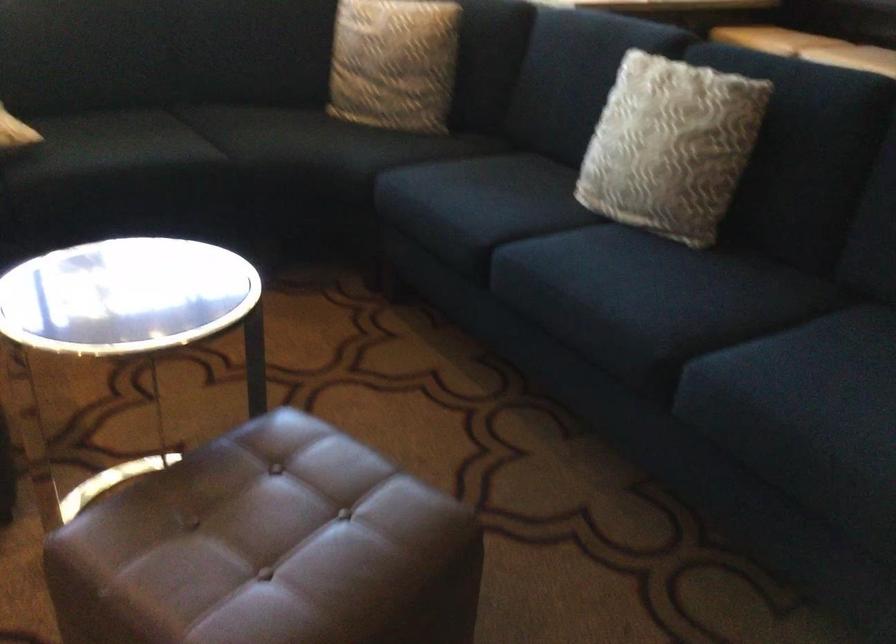
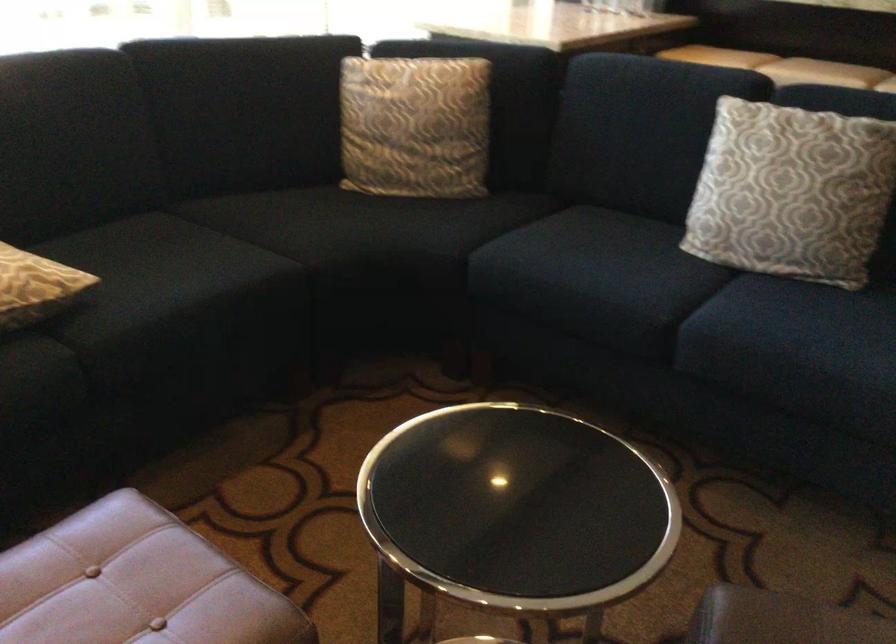
In the second image, find the point that corresponds to (x=461, y=198) in the first image.

(590, 274)